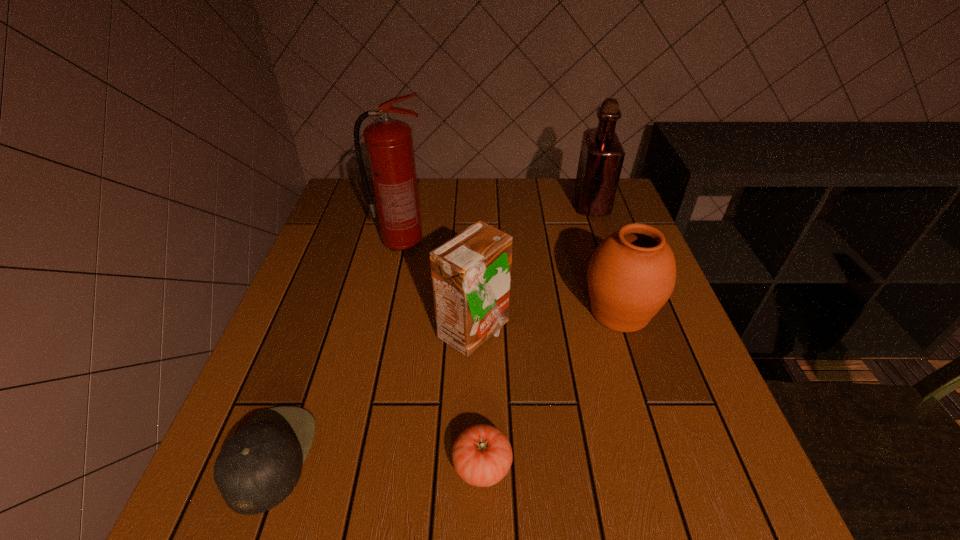
The height and width of the screenshot is (540, 960). In order to click on fire extinguisher in this screenshot , I will do `click(389, 146)`.

Find the location of a particular element. Image resolution: width=960 pixels, height=540 pixels. the tallest object is located at coordinates (389, 146).

What are the coordinates of `the farthest object` in the screenshot? It's located at (601, 158).

Image resolution: width=960 pixels, height=540 pixels. Identify the location of liquor. (601, 158).

At what (x,y) coordinates should I click in order to perform the action: click on carton. Please return your answer as a coordinate pair (x, y). Looking at the image, I should click on (471, 273).

Where is `urn`? The height and width of the screenshot is (540, 960). urn is located at coordinates (631, 275).

You are a GUI agent. You are given a task and a screenshot of the screen. Output one action in this format:
    pyautogui.click(x=<x>, y=<y>)
    Task: Click on the leftmost object
    The image size is (960, 540).
    Given the screenshot: What is the action you would take?
    pyautogui.click(x=256, y=469)

Where is `the second shortest object`? The width and height of the screenshot is (960, 540). the second shortest object is located at coordinates (256, 469).

The image size is (960, 540). Find the location of `the shortest object`. the shortest object is located at coordinates (482, 455).

The image size is (960, 540). What are the coordinates of `free space located 0.130m on the handle side the fire extinguisher` in the screenshot? It's located at (480, 244).